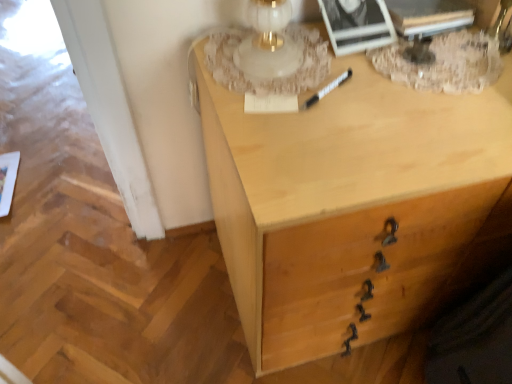
Image resolution: width=512 pixels, height=384 pixels. What do you see at coordinates (355, 206) in the screenshot?
I see `light wood chest of drawers at center` at bounding box center [355, 206].

Locate an element on the screen. light wood chest of drawers at center is located at coordinates (355, 206).

At what (x,y) coordinates should I click in order to perform the action: click on light wood chest of drawers at center. Please return your answer as a coordinate pair (x, y). The width and height of the screenshot is (512, 384). Looking at the image, I should click on (355, 206).